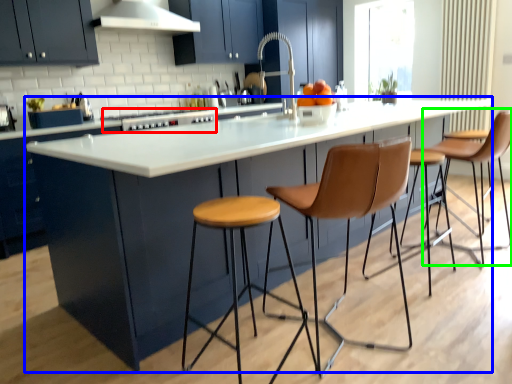
Question: Which object is the farthest from stove (highlighted by a red box)? Choose among these: table (highlighted by a blue box) or chair (highlighted by a green box).

Choices:
 (A) table
 (B) chair

Answer: (B)